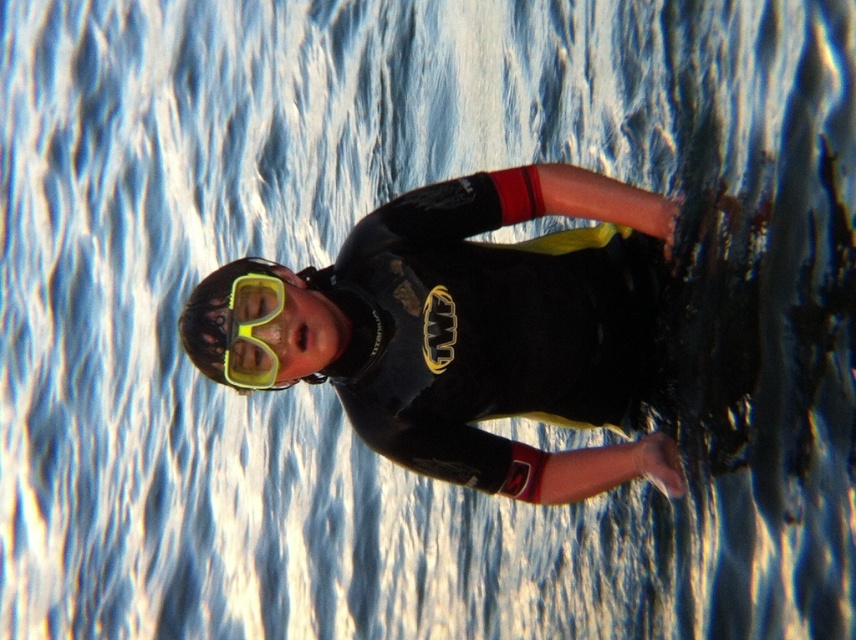
Can you confirm if black matte wetsuit at center is smaller than yellow matte/glossy goggles at center?

No.

Between black matte wetsuit at center and yellow matte/glossy goggles at center, which one has more height?

With more height is black matte wetsuit at center.

What do you see at coordinates (480, 330) in the screenshot? This screenshot has height=640, width=856. I see `black matte wetsuit at center` at bounding box center [480, 330].

The width and height of the screenshot is (856, 640). I want to click on black matte wetsuit at center, so click(480, 330).